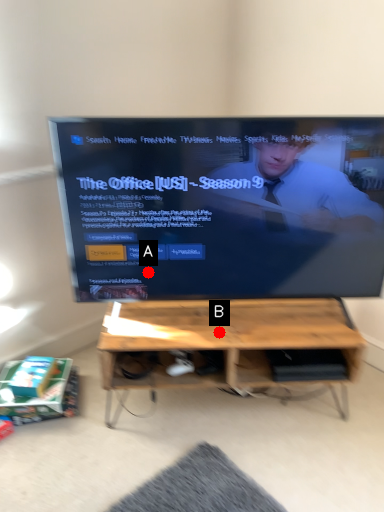
Question: Two points are circled on the image, labeled by A and B beside each circle. Which point is closer to the camera taking this photo?

Choices:
 (A) A is closer
 (B) B is closer

Answer: (A)